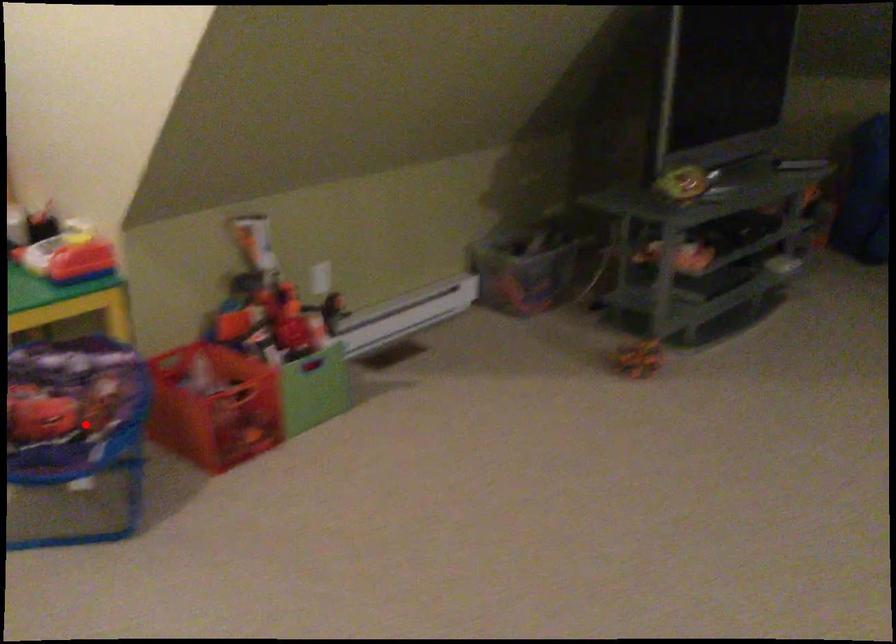
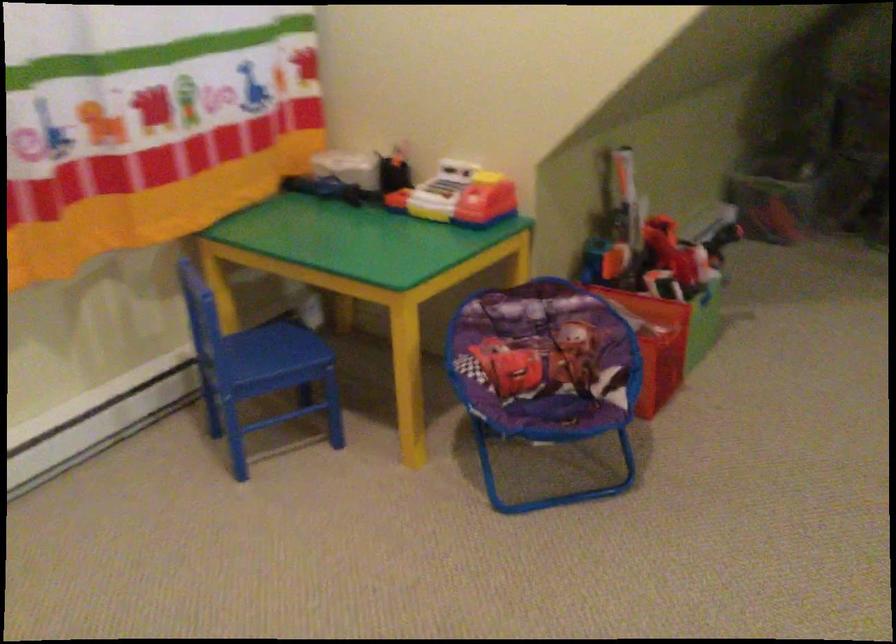
Question: I am providing you with two images of the same scene from different viewpoints. Given a red point in image1, look at the same physical point in image2. Is it:

Choices:
 (A) Closer to the viewpoint
 (B) Farther from the viewpoint

Answer: (A)